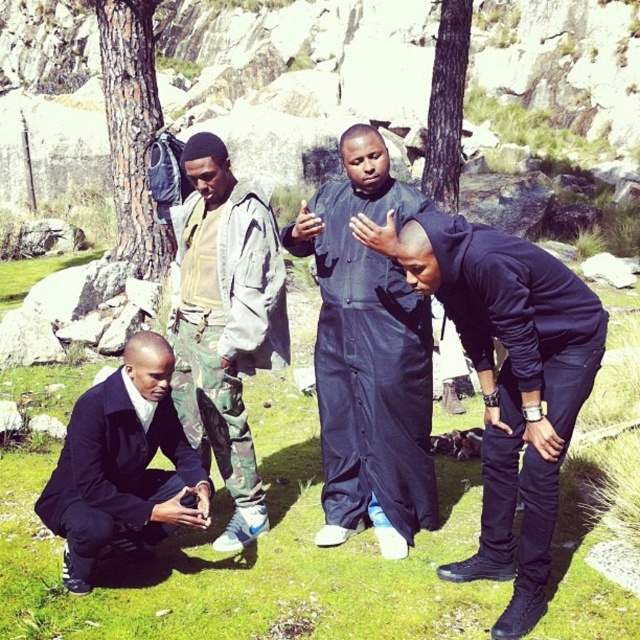
Question: Which object appears farthest from the camera in this image?

Choices:
 (A) black matte jumpsuit at center
 (B) camouflage fabric pants at lower left
 (C) matte black suit at lower left
 (D) green grass at center

Answer: (D)

Question: Which object appears closest to the camera in this image?

Choices:
 (A) black matte jumpsuit at center
 (B) matte black suit at lower left
 (C) camouflage fabric pants at lower left

Answer: (B)

Question: Can you confirm if green grass at center is positioned to the right of black matte hoodie at center?

Choices:
 (A) no
 (B) yes

Answer: (A)

Question: Does green grass at center appear under matte black suit at lower left?

Choices:
 (A) yes
 (B) no

Answer: (A)

Question: Can you confirm if black matte hoodie at center is smaller than camouflage fabric pants at lower left?

Choices:
 (A) yes
 (B) no

Answer: (A)

Question: Based on their relative distances, which object is nearer to the black matte jumpsuit at center?

Choices:
 (A) green grass at center
 (B) camouflage fabric pants at lower left
 (C) matte black suit at lower left
 (D) black matte hoodie at center

Answer: (B)